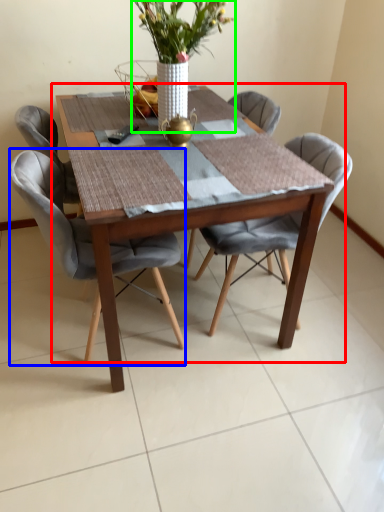
Question: Which object is positioned farthest from kitchen & dining room table (highlighted by a red box)? Select from chair (highlighted by a blue box) and houseplant (highlighted by a green box).

Choices:
 (A) chair
 (B) houseplant

Answer: (B)